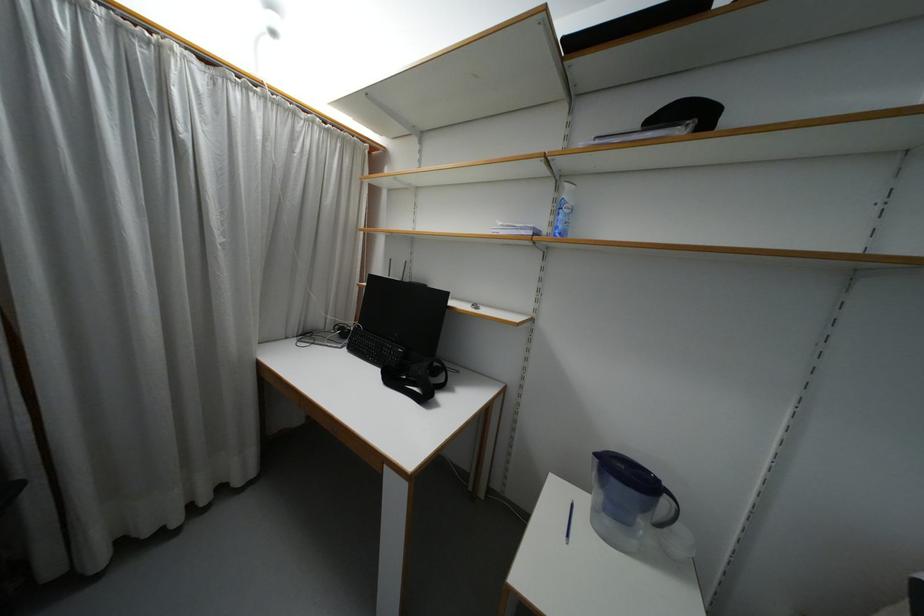
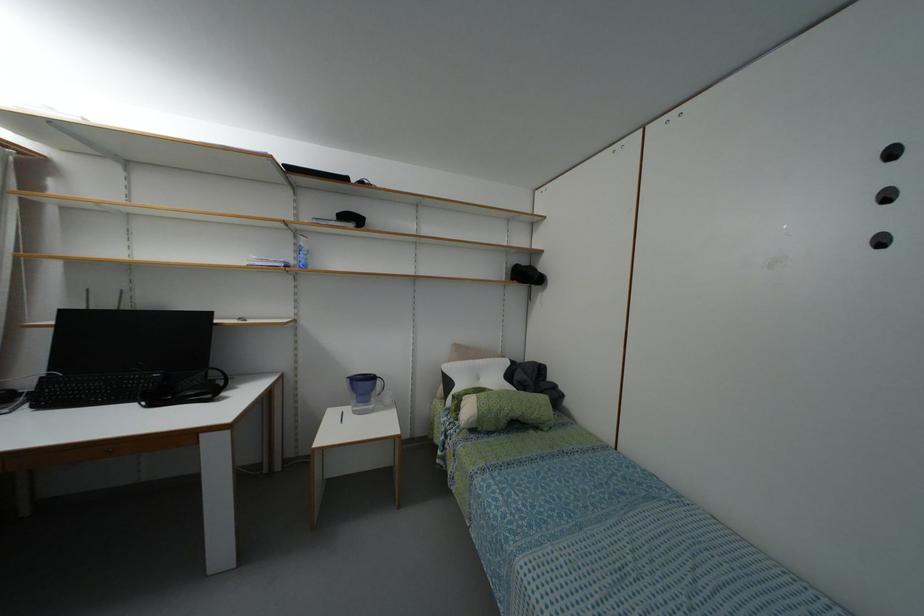
Question: How did the camera likely rotate?

Choices:
 (A) Left
 (B) Right
 (C) Up
 (D) Down

Answer: (B)